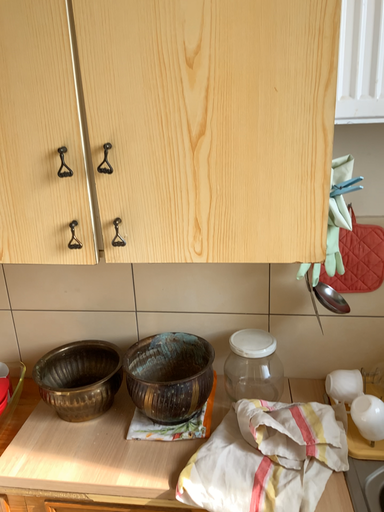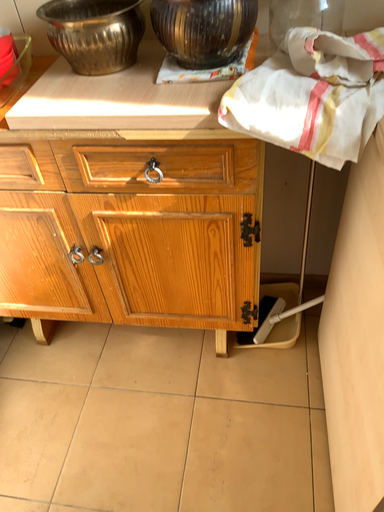
Question: How did the camera likely rotate when shooting the video?

Choices:
 (A) rotated downward
 (B) rotated upward

Answer: (A)